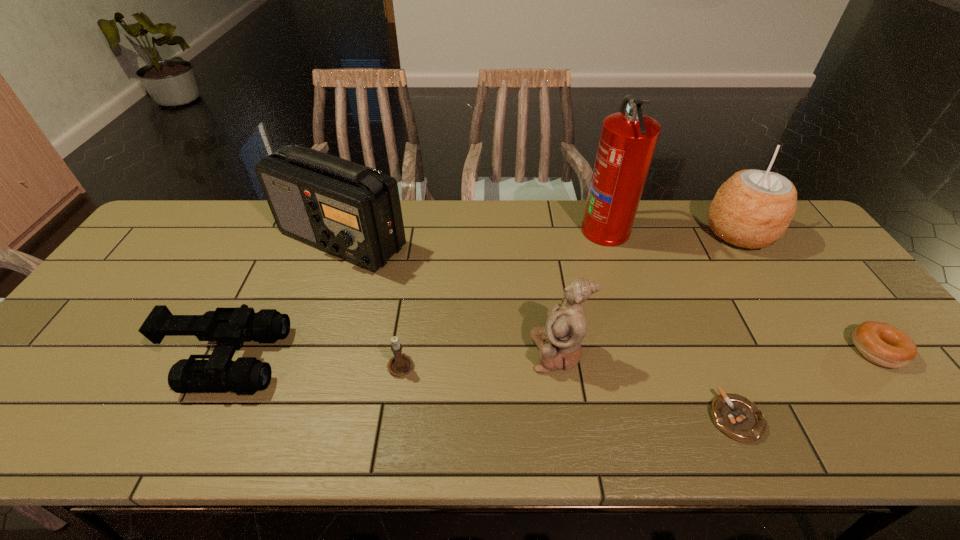
Where is `ashtray`? ashtray is located at coordinates (736, 416).

The height and width of the screenshot is (540, 960). What are the coordinates of `vacant space situated 0.290m on the instruction side of the fifth object from left to right` in the screenshot? It's located at (491, 228).

Image resolution: width=960 pixels, height=540 pixels. Find the location of `vacant space situated 0.280m on the instruction side of the fifth object from left to right`. vacant space situated 0.280m on the instruction side of the fifth object from left to right is located at coordinates (493, 228).

Identify the location of vacant area situated 0.100m on the instruction side of the fifth object from left to right. (550, 228).

I want to click on blank space located 0.400m on the front panel of the radio receiver, so click(287, 402).

Locate an element on the screen. The image size is (960, 540). vacant area located on the right of the coconut is located at coordinates [793, 233].

Where is `free space located 0.150m on the front-facing side of the figurine`? This screenshot has height=540, width=960. free space located 0.150m on the front-facing side of the figurine is located at coordinates (469, 352).

Identify the location of vacant space located 0.080m on the front-facing side of the figurine. (498, 352).

In order to click on vacant space located on the front-facing side of the figurine in this screenshot , I will do `click(449, 352)`.

At what (x,y) coordinates should I click in order to perform the action: click on vacant position located 0.130m on the front lenses of the fifth tallest object. Please return your answer as a coordinate pair (x, y). The width and height of the screenshot is (960, 540). Looking at the image, I should click on (335, 359).